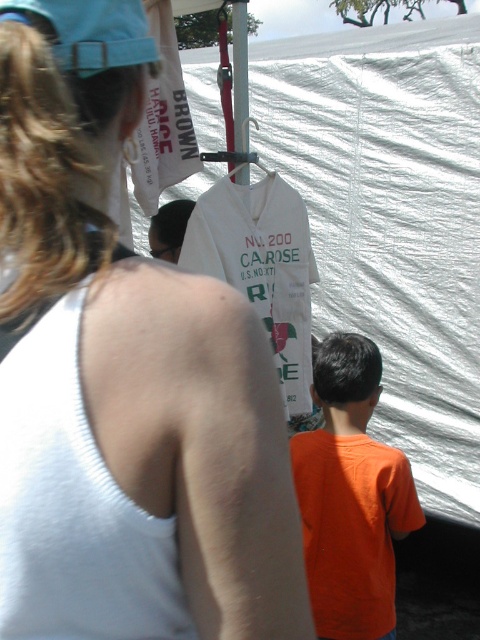
Looking at this image, how much distance is there between white fabric tank top at upper left and white cotton t-shirt at center?

white fabric tank top at upper left and white cotton t-shirt at center are 4.61 feet apart.

Can you confirm if white fabric tank top at upper left is positioned to the left of white cotton t-shirt at center?

Indeed, white fabric tank top at upper left is positioned on the left side of white cotton t-shirt at center.

Is point (66, 154) positioned before point (214, 209)?

Yes, point (66, 154) is in front of point (214, 209).

The width and height of the screenshot is (480, 640). What are the coordinates of `white fabric tank top at upper left` in the screenshot? It's located at (123, 376).

Can you confirm if orange matte shirt at lower right is positioned to the left of white cotton t-shirt at center?

In fact, orange matte shirt at lower right is to the right of white cotton t-shirt at center.

Is point (316, 605) farther from camera compared to point (192, 257)?

Yes, point (316, 605) is farther from viewer.

Where is `orange matte shirt at lower right`? Image resolution: width=480 pixels, height=640 pixels. orange matte shirt at lower right is located at coordinates (350, 497).

Which of these two, white fabric tent at center or white cotton t-shirt at center, stands taller?

Standing taller between the two is white fabric tent at center.

Is point (207, 52) closer to camera compared to point (292, 339)?

No, (207, 52) is further to viewer.

This screenshot has width=480, height=640. Describe the element at coordinates (392, 220) in the screenshot. I see `white fabric tent at center` at that location.

The height and width of the screenshot is (640, 480). I want to click on white fabric tent at center, so click(x=392, y=220).